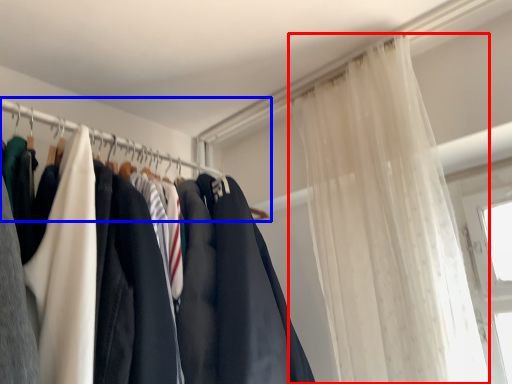
Question: Which point is closer to the camera, curtain (highlighted by a red box) or clothesline (highlighted by a blue box)?

Choices:
 (A) curtain
 (B) clothesline

Answer: (A)